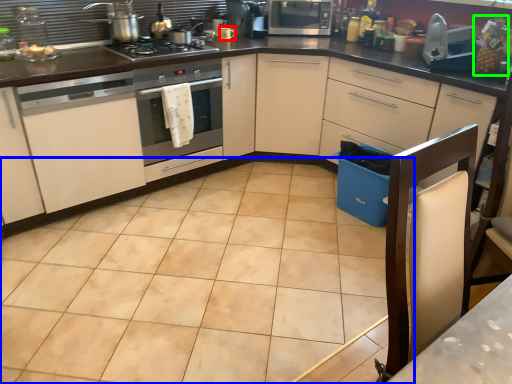
Question: Based on their relative distances, which object is farther from appliance (highlighted by a red box)? Choose from ceramic tile (highlighted by a blue box) and fruit (highlighted by a green box).

Choices:
 (A) ceramic tile
 (B) fruit

Answer: (A)